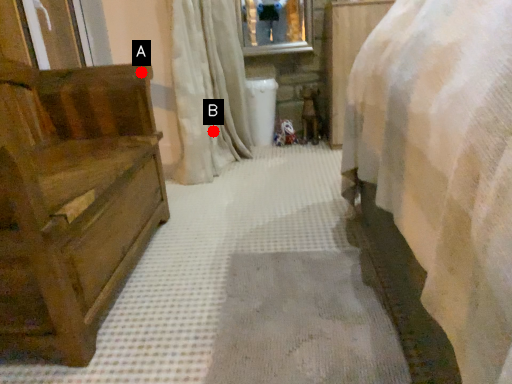
Question: Two points are circled on the image, labeled by A and B beside each circle. Which point is farther to the camera?

Choices:
 (A) A is further
 (B) B is further

Answer: (B)